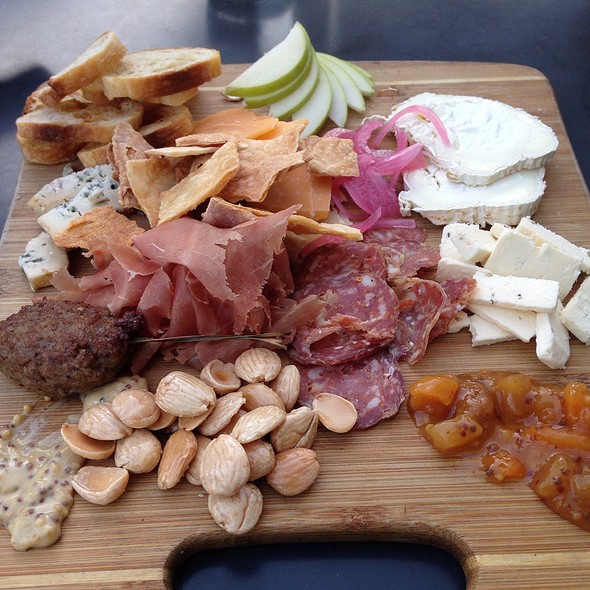
Where is `cutting board`? This screenshot has height=590, width=590. cutting board is located at coordinates (559, 195).